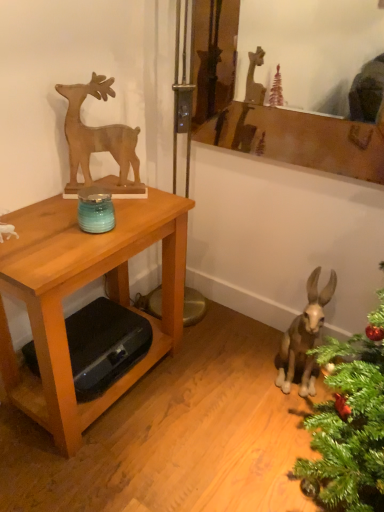
Where is `vacant area to the right of wooden deer at upper left`? vacant area to the right of wooden deer at upper left is located at coordinates (149, 204).